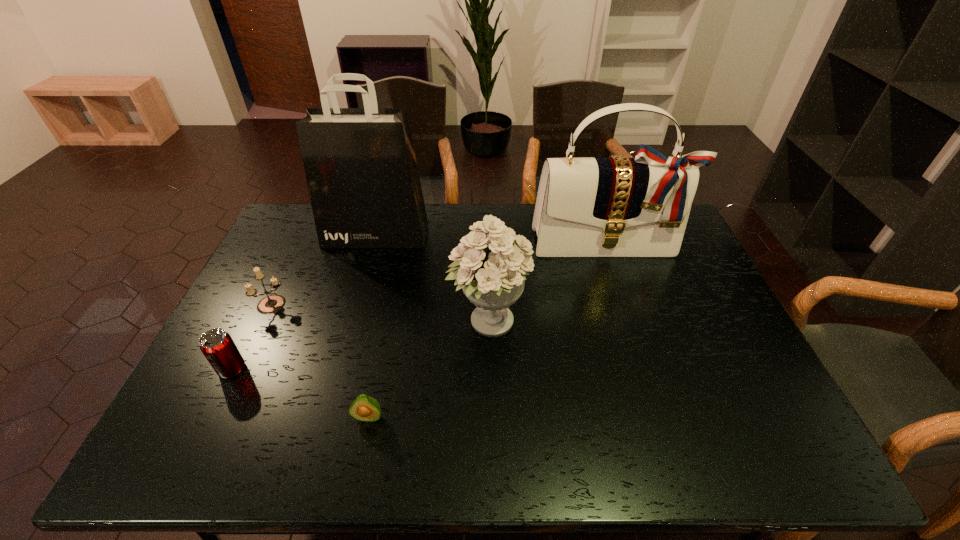
At what (x,y) coordinates should I click in order to perform the action: click on shopping bag. Please return your answer as a coordinate pair (x, y). Looking at the image, I should click on (360, 165).

I want to click on the rightmost object, so click(618, 206).

Where is `the fifth object from left to right`? the fifth object from left to right is located at coordinates (492, 273).

This screenshot has width=960, height=540. Identify the location of the fourth shortest object. (492, 273).

Where is `soda can`? soda can is located at coordinates (218, 347).

Identify the location of candle holder. The height and width of the screenshot is (540, 960). (271, 304).

Where is `avocado`? avocado is located at coordinates (364, 408).

Locate an element on the screen. vacant space situated 0.120m on the front with handles of the shopping bag is located at coordinates (365, 272).

You are a GUI agent. You are given a task and a screenshot of the screen. Output one action in this format:
    pyautogui.click(x=<x>, y=<y>)
    Task: Click on the free location located on the front-facing side of the satchel
    Image resolution: width=960 pixels, height=540 pixels.
    Given the screenshot: What is the action you would take?
    pyautogui.click(x=639, y=342)

Image resolution: width=960 pixels, height=540 pixels. I want to click on vacant region located on the front of the fifth object from left to right, so click(x=491, y=432).